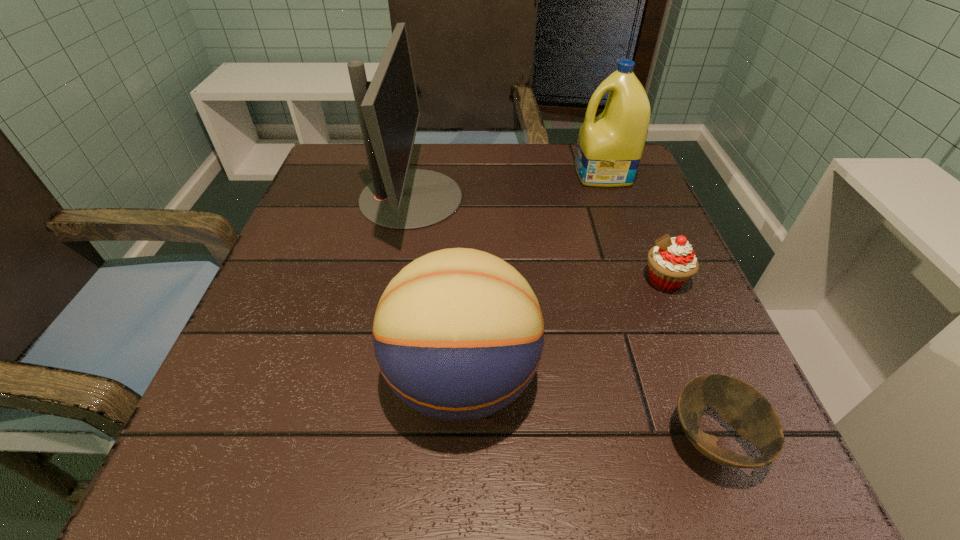
This screenshot has height=540, width=960. What are the coordinates of `bowl situated at the right edge` in the screenshot? It's located at (744, 408).

Locate an element on the screen. object positioned at the far left corner is located at coordinates (399, 198).

Locate an element on the screen. object positioned at the far right corner is located at coordinates (609, 148).

This screenshot has width=960, height=540. Find the location of `object that is at the near right corner`. object that is at the near right corner is located at coordinates (744, 408).

In the image, there is a desktop. Where is `vacant area at the far edge`? The width and height of the screenshot is (960, 540). vacant area at the far edge is located at coordinates (421, 158).

Where is `blank area at the near edge`? This screenshot has width=960, height=540. blank area at the near edge is located at coordinates (632, 457).

I want to click on free region at the left edge, so click(x=322, y=319).

Find the location of a particular element. The image size is (960, 540). vacant space at the right edge of the desktop is located at coordinates (630, 238).

You are a GUI agent. You are given a task and a screenshot of the screen. Output one action in this format:
    pyautogui.click(x=<x>, y=<y>)
    Task: Click on the free space at the near left corner of the desktop
    
    Given the screenshot: What is the action you would take?
    (187, 475)

Locate an element on the screen. This screenshot has width=960, height=540. vacant space at the far right corner is located at coordinates (577, 174).